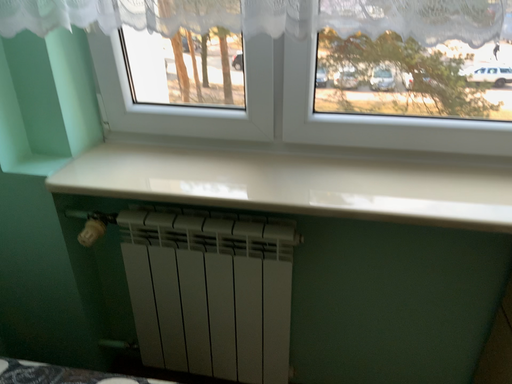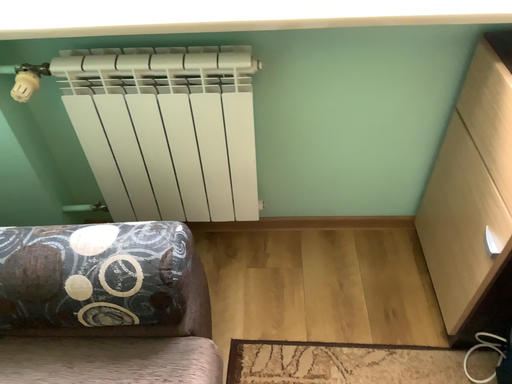
Question: Which way did the camera rotate in the video?

Choices:
 (A) rotated upward
 (B) rotated downward

Answer: (B)